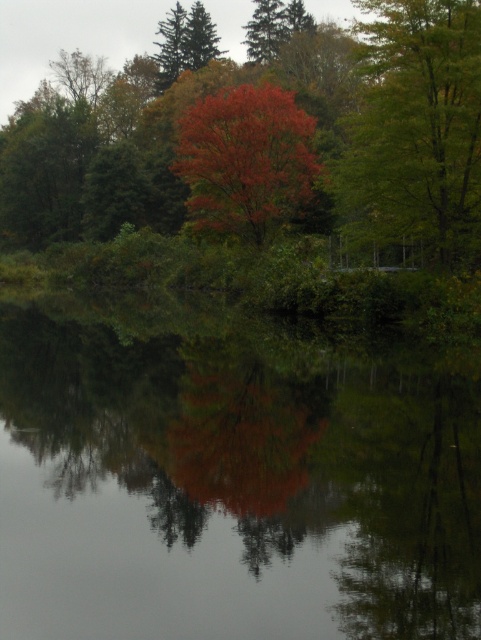
Question: Does green matte tree at upper right appear under shiny red leaves at center?

Choices:
 (A) no
 (B) yes

Answer: (B)

Question: Is vivid red leaves at center thinner than green matte tree at upper right?

Choices:
 (A) yes
 (B) no

Answer: (B)

Question: Estimate the real-world distances between objects in this image. Which object is closer to the green matte tree at upper right?

Choices:
 (A) vivid red leaves at center
 (B) transparent water at center

Answer: (A)

Question: Based on their relative distances, which object is nearer to the green matte tree at upper right?

Choices:
 (A) shiny red leaves at center
 (B) vivid red leaves at center
 (C) transparent water at center

Answer: (A)

Question: Which of the following is the farthest from the observer?

Choices:
 (A) shiny red leaves at center
 (B) vivid red leaves at center

Answer: (A)

Question: Is transparent water at center bigger than shiny red leaves at center?

Choices:
 (A) yes
 (B) no

Answer: (B)